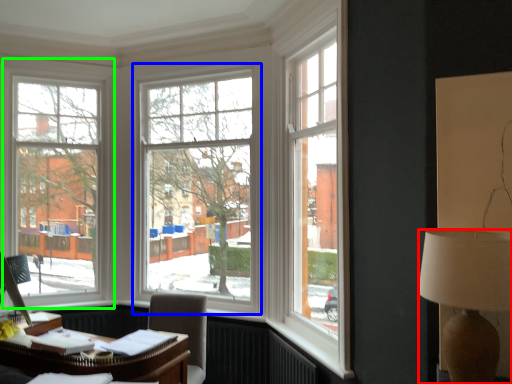
Question: Considering the real-world distances, which object is farthest from lamp (highlighted by a red box)? window (highlighted by a blue box) or window (highlighted by a green box)?

Choices:
 (A) window
 (B) window

Answer: (B)